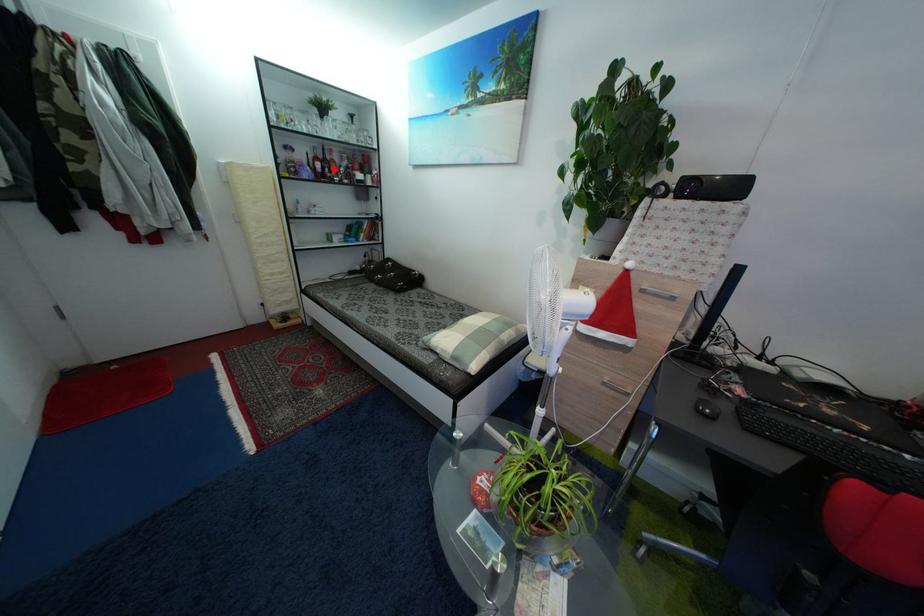
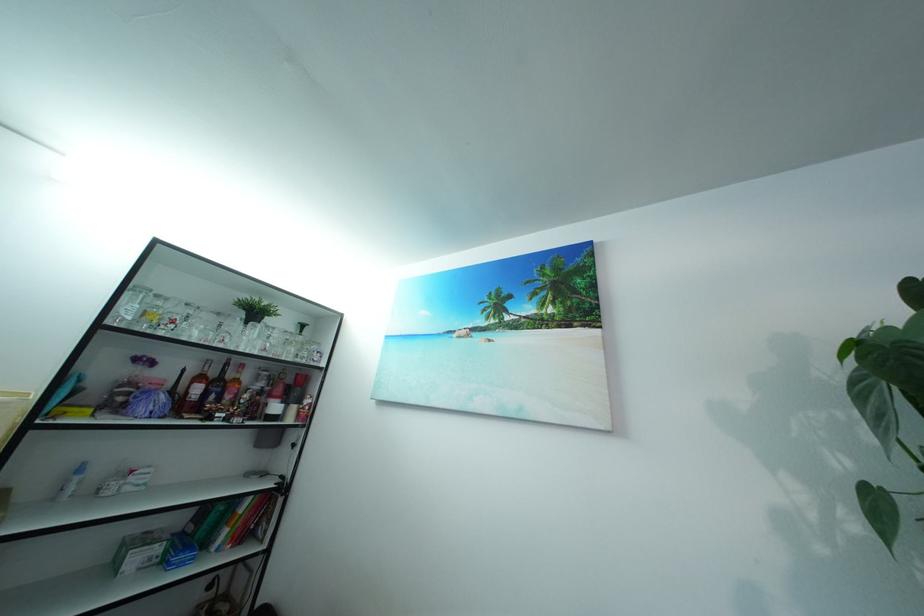
Find the pixel in the second image that matches the highlighted location in the first image.

(226, 391)